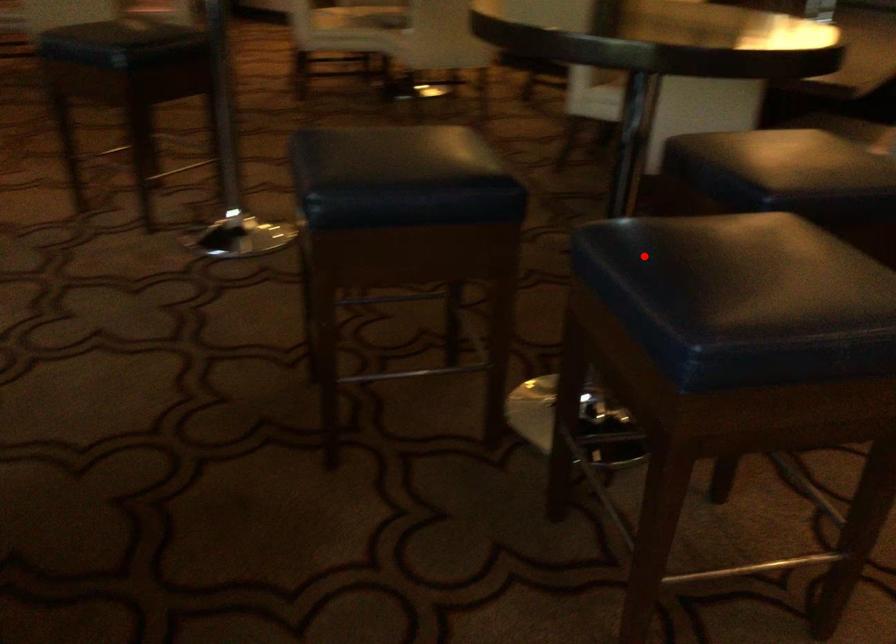
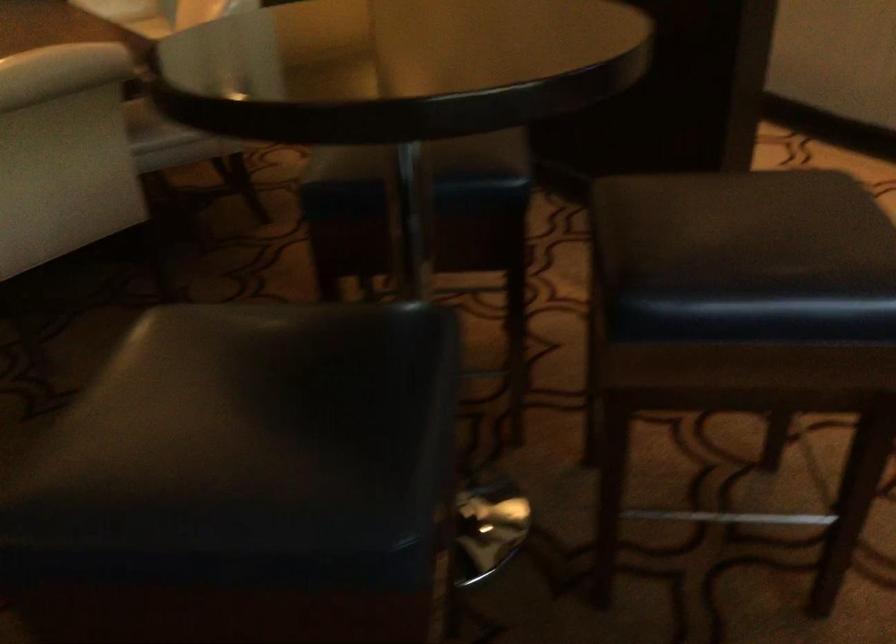
Question: I am providing you with two images of the same scene from different viewpoints. Image1 has a red point marked. In image2, the corresponding 3D location appears at what relative position? Reply with the corresponding letter.

Choices:
 (A) Closer
 (B) Farther

Answer: (A)